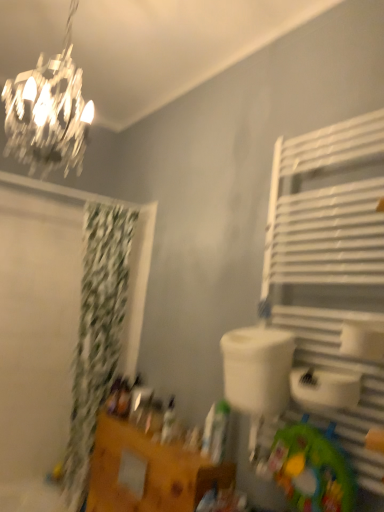
Question: Is white plastic sink at center at the back of green fabric mat at lower right?

Choices:
 (A) yes
 (B) no

Answer: (B)

Question: Is white plastic sink at center inside green fabric mat at lower right?

Choices:
 (A) no
 (B) yes

Answer: (A)

Question: Is there a large distance between green fabric mat at lower right and white plastic sink at center?

Choices:
 (A) no
 (B) yes

Answer: (A)

Question: From a real-world perspective, is green fabric mat at lower right positioned over white plastic sink at center based on gravity?

Choices:
 (A) yes
 (B) no

Answer: (B)

Question: From the image's perspective, is green fabric mat at lower right beneath white plastic sink at center?

Choices:
 (A) no
 (B) yes

Answer: (B)

Question: From a real-world perspective, is white metal towel rack at right physically located above or below white plastic sink at center?

Choices:
 (A) below
 (B) above

Answer: (B)

Question: Would you say white metal towel rack at right is to the left or to the right of white plastic sink at center in the picture?

Choices:
 (A) right
 (B) left

Answer: (A)

Question: In terms of height, does white metal towel rack at right look taller or shorter compared to white plastic sink at center?

Choices:
 (A) short
 (B) tall

Answer: (B)

Question: Based on their sizes in the image, would you say white metal towel rack at right is bigger or smaller than white plastic sink at center?

Choices:
 (A) big
 (B) small

Answer: (A)

Question: Considering the relative positions of green fabric shower curtain at left and shiny crystal chandelier at upper left in the image provided, is green fabric shower curtain at left to the left or to the right of shiny crystal chandelier at upper left?

Choices:
 (A) left
 (B) right

Answer: (A)

Question: From the image's perspective, is green fabric shower curtain at left above or below shiny crystal chandelier at upper left?

Choices:
 (A) below
 (B) above

Answer: (A)

Question: From a real-world perspective, relative to shiny crystal chandelier at upper left, is green fabric shower curtain at left vertically above or below?

Choices:
 (A) below
 (B) above

Answer: (A)

Question: In the image, is green fabric shower curtain at left positioned in front of or behind shiny crystal chandelier at upper left?

Choices:
 (A) behind
 (B) front

Answer: (A)

Question: From a real-world perspective, is white plastic sink at center above or below green fabric shower curtain at left?

Choices:
 (A) below
 (B) above

Answer: (B)

Question: From the image's perspective, is white plastic sink at center located above or below green fabric shower curtain at left?

Choices:
 (A) above
 (B) below

Answer: (A)